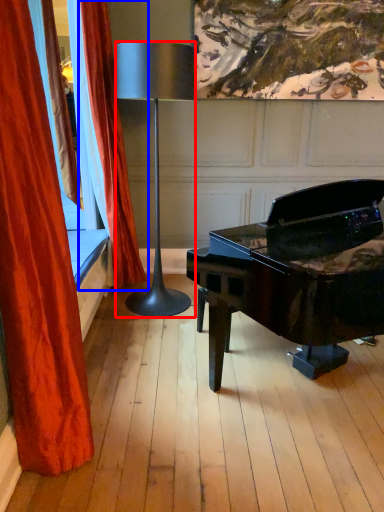
Question: Among these objects, which one is nearest to the camera, lamp (highlighted by a red box) or curtain (highlighted by a blue box)?

Choices:
 (A) lamp
 (B) curtain

Answer: (A)